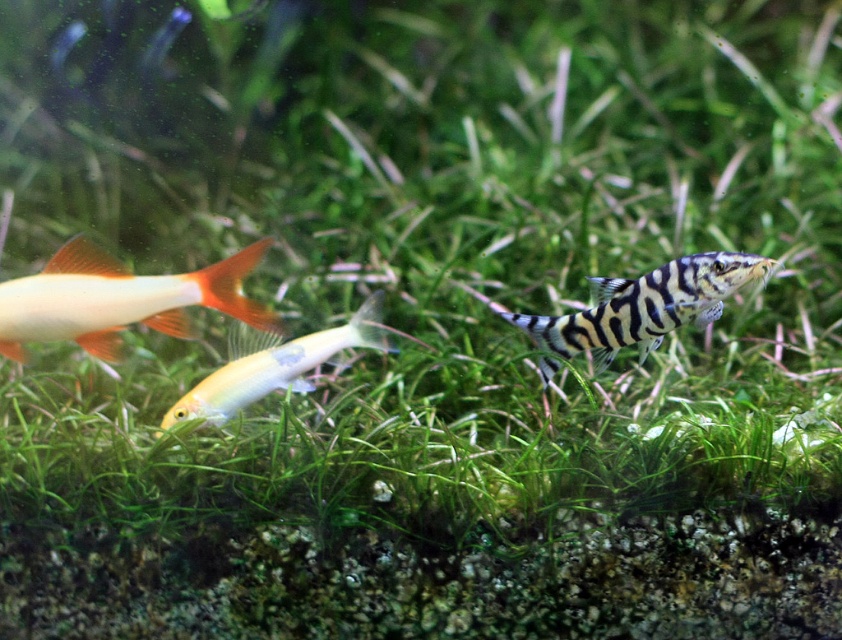
Can you confirm if shiny orange fish at left is shorter than shiny yellow fish at center?

Yes.

Is shiny orange fish at left closer to the viewer compared to shiny yellow fish at center?

Yes, it is in front of shiny yellow fish at center.

Does point (48, 324) lie behind point (329, 339)?

That is False.

What are the coordinates of `shiny orange fish at left` in the screenshot? It's located at (118, 300).

Can you confirm if black and white striped fish at center is smaller than shiny yellow fish at center?

Correct, black and white striped fish at center occupies less space than shiny yellow fish at center.

Is point (662, 296) farther from viewer compared to point (272, 371)?

No, it is not.

Between point (541, 362) and point (233, 346), which one is positioned behind?

The point (233, 346) is behind.

Find the location of a particular element. The image size is (842, 640). black and white striped fish at center is located at coordinates (641, 308).

Is shiny orange fish at left above black and white striped fish at center?

Indeed, shiny orange fish at left is positioned over black and white striped fish at center.

Between shiny orange fish at left and black and white striped fish at center, which one appears on the left side from the viewer's perspective?

shiny orange fish at left

Find the location of a particular element. The height and width of the screenshot is (640, 842). shiny orange fish at left is located at coordinates (118, 300).

Where is `shiny orange fish at left`? The width and height of the screenshot is (842, 640). shiny orange fish at left is located at coordinates (118, 300).